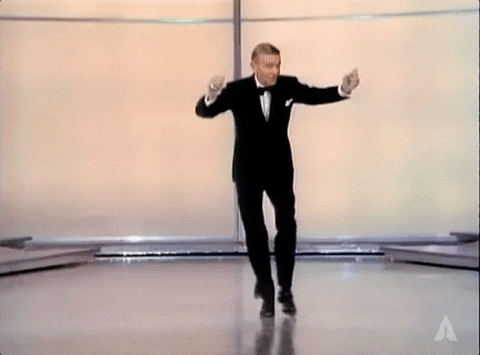
You are a GUI agent. You are given a task and a screenshot of the screen. Output one action in this format:
    pyautogui.click(x=<x>, y=<y>)
    Task: Click on the place to hang a mirror
    The height and width of the screenshot is (355, 480).
    Given the screenshot: What is the action you would take?
    pyautogui.click(x=108, y=104)